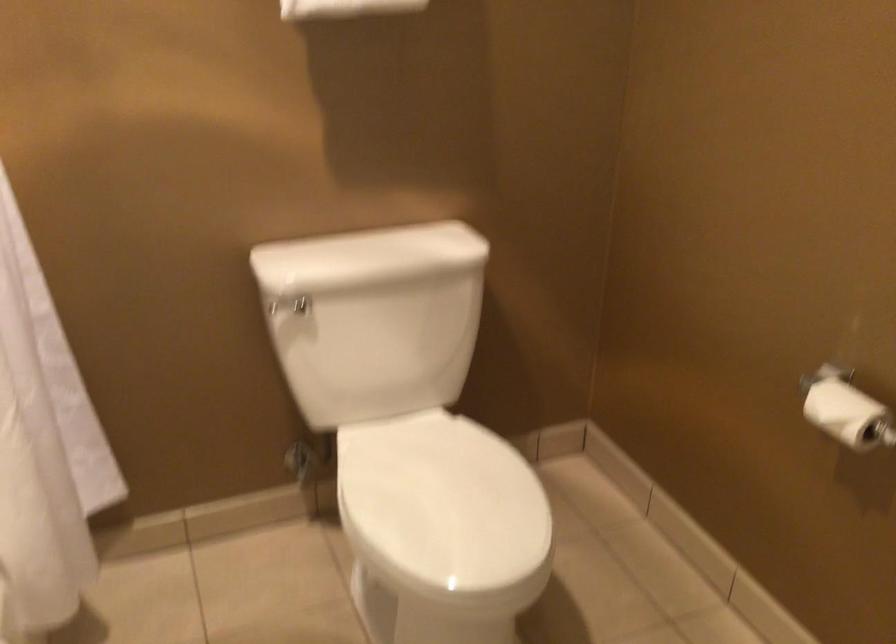
This screenshot has height=644, width=896. I want to click on white toilet lid, so click(x=442, y=505).